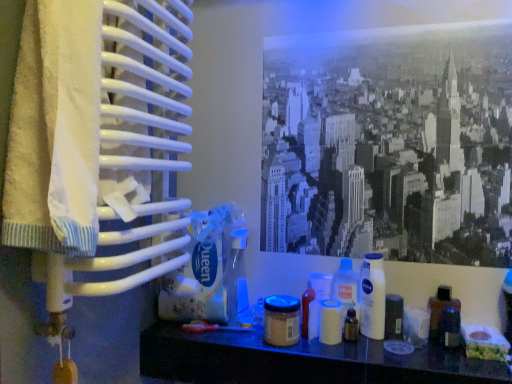
The height and width of the screenshot is (384, 512). Identify the location of space that is in front of white plastic container at center, positioned as the 4th toiletry in right-to-left order. (345, 357).